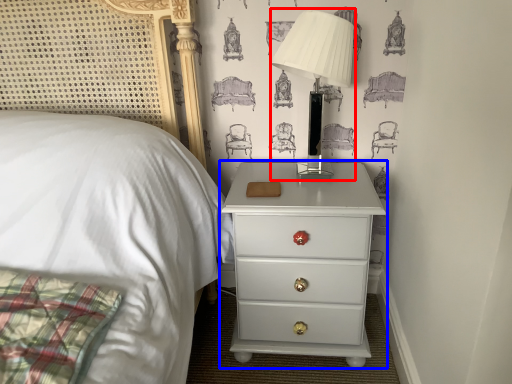
Question: Among these objects, which one is farthest to the camera, table lamp (highlighted by a red box) or nightstand (highlighted by a blue box)?

Choices:
 (A) table lamp
 (B) nightstand

Answer: (B)